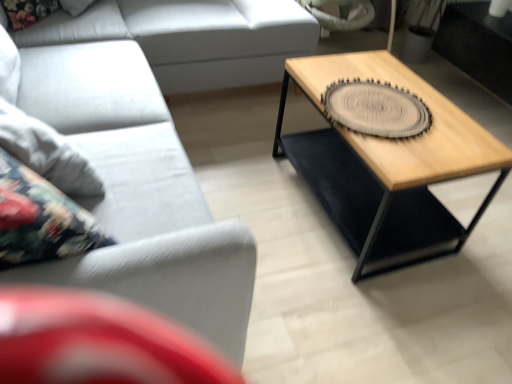
Where is `vacant location behind gray textured coaster at center right`? The image size is (512, 384). vacant location behind gray textured coaster at center right is located at coordinates (360, 71).